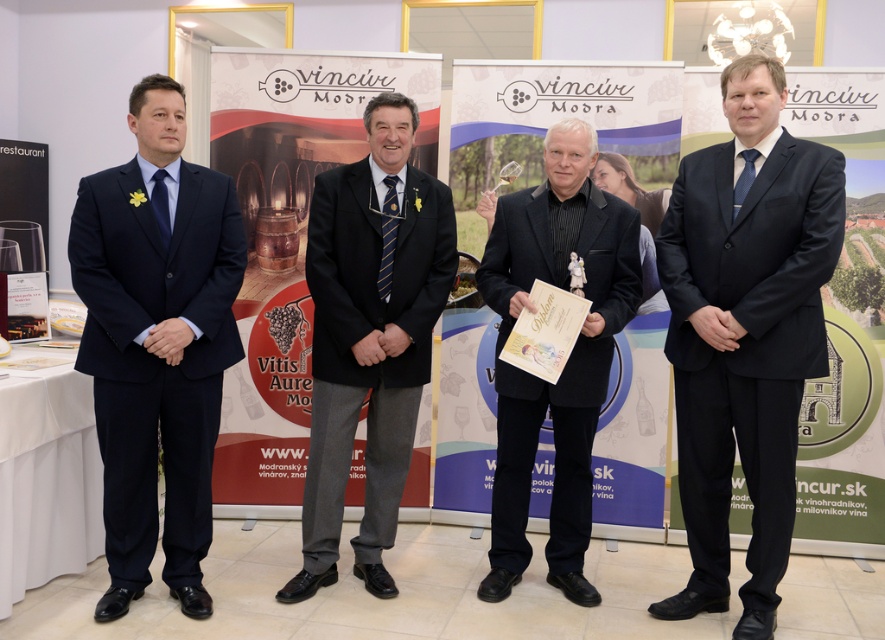
You are at a wine ceremony and need to locate the person holding a certificate. Based on the coordinates provided, where should you look to find the matte black suit at center?

The matte black suit at center is located at coordinates point (x=745, y=333), so you should look there to find the person holding the certificate.

You are a photographer at the event and need to adjust your camera focus. You notice two points in the image at coordinates point (736, 244) and point (165, 540). Which point should you focus on first if you want to ensure the closest object is in sharp focus?

You should focus on point (736, 244) first because it is closer to the camera than point (165, 540), ensuring the closest object is in sharp focus.

Looking at this image, you are a photographer at the event and need to adjust the lighting so that the black wool suit at center and the blue striped tie at center are both visible. Which object should you focus on first to ensure proper exposure, considering their sizes?

The black wool suit at center is much taller than the blue striped tie at center, so you should focus on the larger black wool suit at center first to ensure proper exposure.